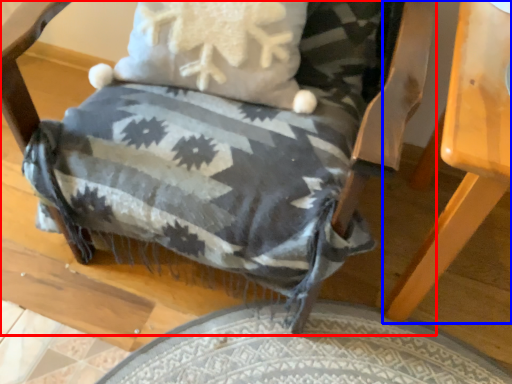
Question: Which of the following is the farthest to the observer, chair (highlighted by a red box) or table (highlighted by a blue box)?

Choices:
 (A) chair
 (B) table

Answer: (B)